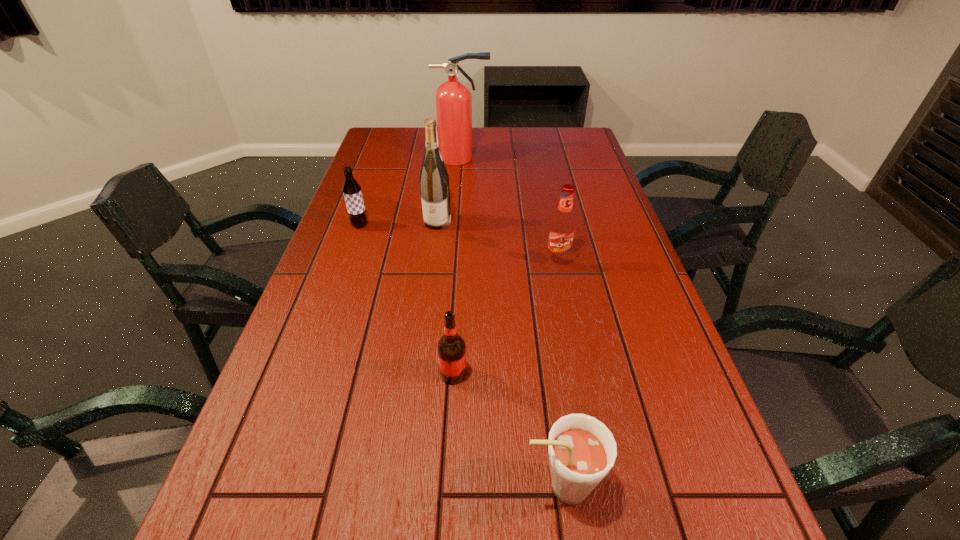
In order to click on fire extinguisher in this screenshot , I will do `click(453, 99)`.

I want to click on wine bottle, so click(434, 181).

Locate an element on the screen. the tallest root beer is located at coordinates (562, 227).

This screenshot has width=960, height=540. What are the coordinates of `the third nearest object` in the screenshot? It's located at (562, 227).

The height and width of the screenshot is (540, 960). In order to click on the leftmost object in this screenshot , I will do `click(351, 189)`.

Identify the location of the leftmost root beer. (351, 189).

You are a GUI agent. You are given a task and a screenshot of the screen. Output one action in this format:
    pyautogui.click(x=<x>, y=<y>)
    Task: Click on the nearest root beer
    This screenshot has height=540, width=960.
    Given the screenshot: What is the action you would take?
    pyautogui.click(x=581, y=449)

This screenshot has height=540, width=960. I want to click on the fifth farthest object, so click(451, 347).

This screenshot has height=540, width=960. Find the location of `the third farthest root beer`. the third farthest root beer is located at coordinates (451, 347).

What are the coordinates of `blank space located on the left of the fire extinguisher` in the screenshot? It's located at (406, 158).